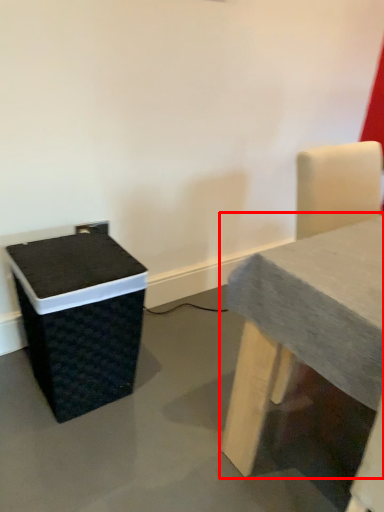
Question: Considering the relative positions of table (annotated by the red box) and recycling bin in the image provided, where is table (annotated by the red box) located with respect to the staircase?

Choices:
 (A) left
 (B) right

Answer: (B)